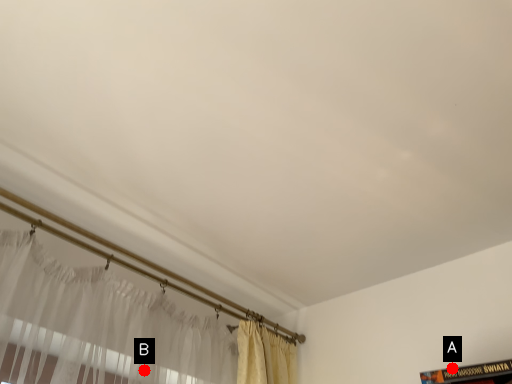
Question: Two points are circled on the image, labeled by A and B beside each circle. Which point is closer to the camera taking this photo?

Choices:
 (A) A is closer
 (B) B is closer

Answer: (B)